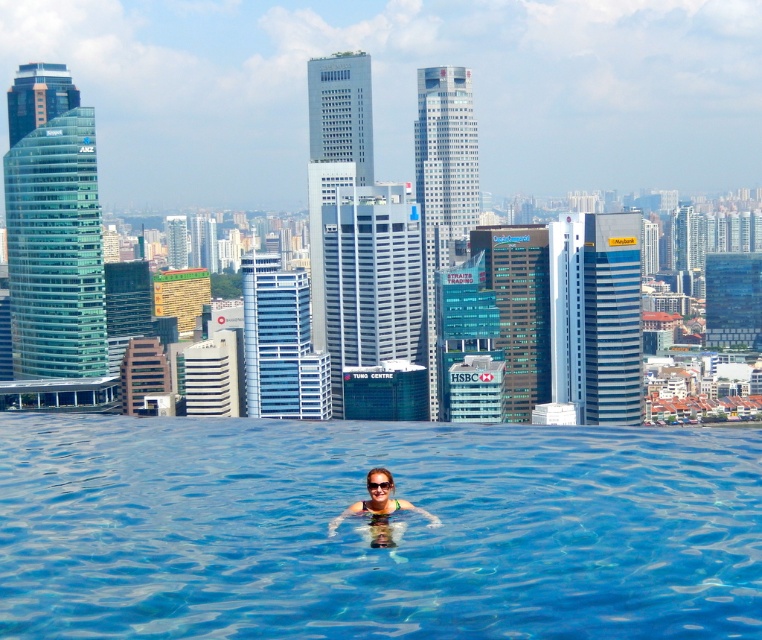
You are standing at the edge of the rooftop infinity pool and want to locate two points marked on the scene. The first point is at coordinate point (549, 625) and the second is at point (373, 483). Which point is nearer to you?

Point (549, 625) is closer to the viewer than point (373, 483), so the first point is nearer to you.

You are a photographer aiming to capture the reflection of the HSBC building in the water of the pool. You have two items in the scene, the matte black swimsuit at center and the transparent plastic goggles at center. Which item should you avoid placing in the water to ensure a clear reflection?

You should avoid placing the matte black swimsuit at center in the water because it is to the left of the transparent plastic goggles at center, and dark objects like the matte black swimsuit can disrupt reflections more than transparent items like the goggles.

You are a drone operator tasked with capturing aerial footage of the transparent blue water at center and transparent plastic goggles at center. The drone has a maximum flight range of 200 feet. Can the drone safely capture both objects in a single flight without needing to recharge?

The transparent blue water at center and transparent plastic goggles at center are 224.07 feet apart, which exceeds the drone operator maximum flight range of 200 feet. The drone cannot safely capture both objects in a single flight without needing to recharge.